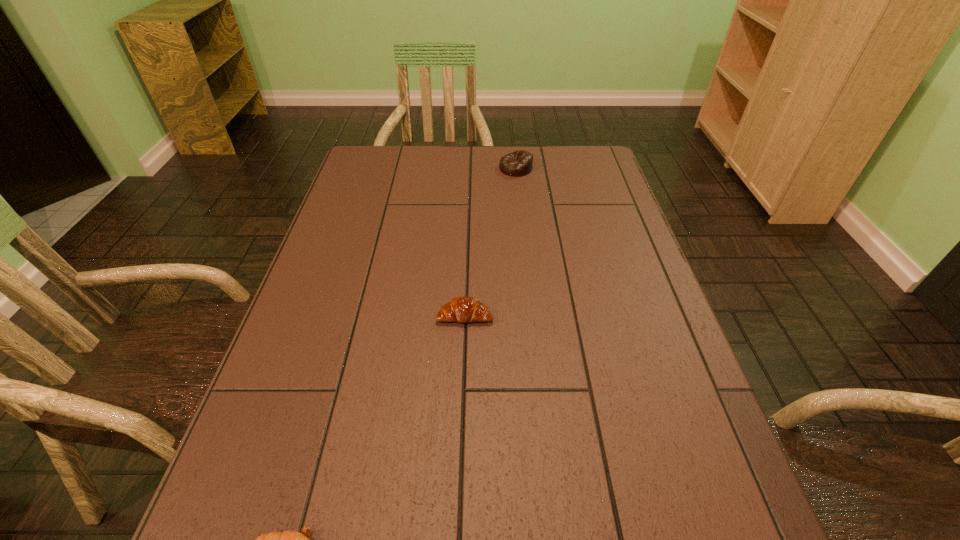
At what (x,y) coordinates should I click in order to perform the action: click on free space at the far left corner. Please return your answer as a coordinate pair (x, y). This screenshot has height=540, width=960. Looking at the image, I should click on [x=395, y=181].

Find the location of a particular element. Image resolution: width=960 pixels, height=540 pixels. free location at the far right corner of the desktop is located at coordinates (573, 183).

Find the location of a particular element. The width and height of the screenshot is (960, 540). vacant space that's between the tallest object and the second nearest object is located at coordinates (491, 242).

The width and height of the screenshot is (960, 540). What are the coordinates of `free space between the rightmost object and the farther crescent roll` in the screenshot? It's located at (491, 242).

In order to click on object that is the closest to the right crescent roll in this screenshot , I will do `click(288, 539)`.

Locate which object is the second closest to the second object from right to left. Please provide its 2D coordinates. Your answer should be formatted as a tuple, i.e. [(x, y)], where the tuple contains the x and y coordinates of a point satisfying the conditions above.

[(518, 163)]